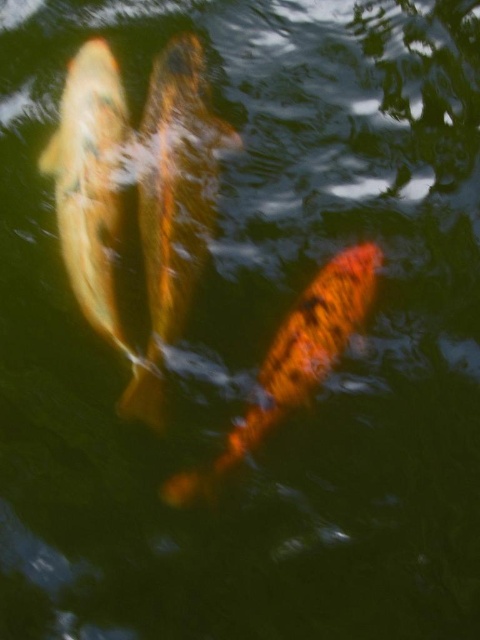
You are an underwater photographer aiming to capture both the shiny gold fish at left and the shiny orange fish at center in a single shot. Based on their positions, which fish should you focus on first to ensure both are in frame?

The shiny gold fish at left is above the shiny orange fish at center, so you should focus on the shiny orange fish at center first to ensure both are in frame as the lower fish will naturally be included when framing the upper one.

You are an underwater photographer aiming to capture the shiny gold fish at left. Your camera has a fixed focus point at coordinates 0.312, 0.198. Will the fish be in focus when you take the photo?

Yes, the shiny gold fish at left is located exactly at the focus point (95, 198), so it will be in focus.

You are a diver exploring the underwater scene. You see two points marked in the water. Which point is closer to you, point (167, 204) or point (107, 305)?

Point (167, 204) is further to the viewer than point (107, 305), so point (107, 305) is closer to you.